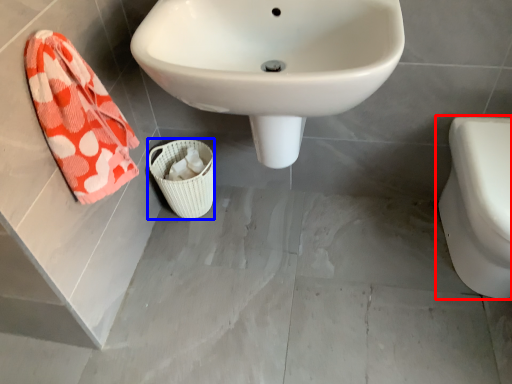
Question: Which object is further to the camera taking this photo, toilet (highlighted by a red box) or basket (highlighted by a blue box)?

Choices:
 (A) toilet
 (B) basket

Answer: (B)